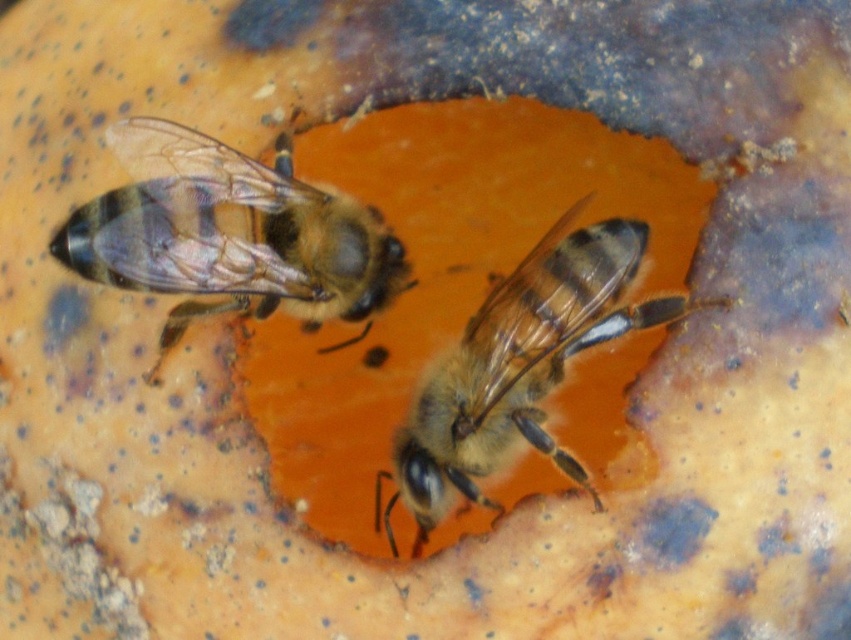
You are a researcher studying bee behavior. You observe a translucent brown bee at upper left and another bee at lower right. You need to mark a point at coordinates point (227, 234). Is this point on the translucent brown bee at upper left or the other bee?

Point (227, 234) is on the translucent brown bee at upper left.